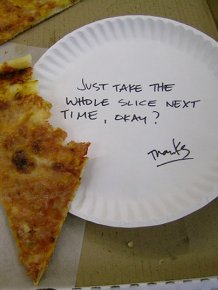
Locate an element on the screen. The image size is (218, 290). bottom of plate is located at coordinates tap(130, 225).